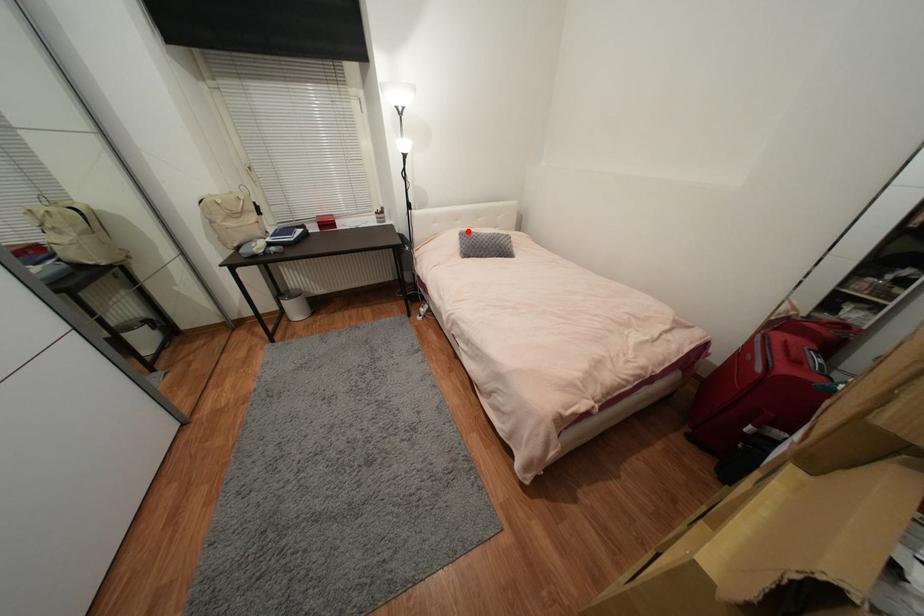
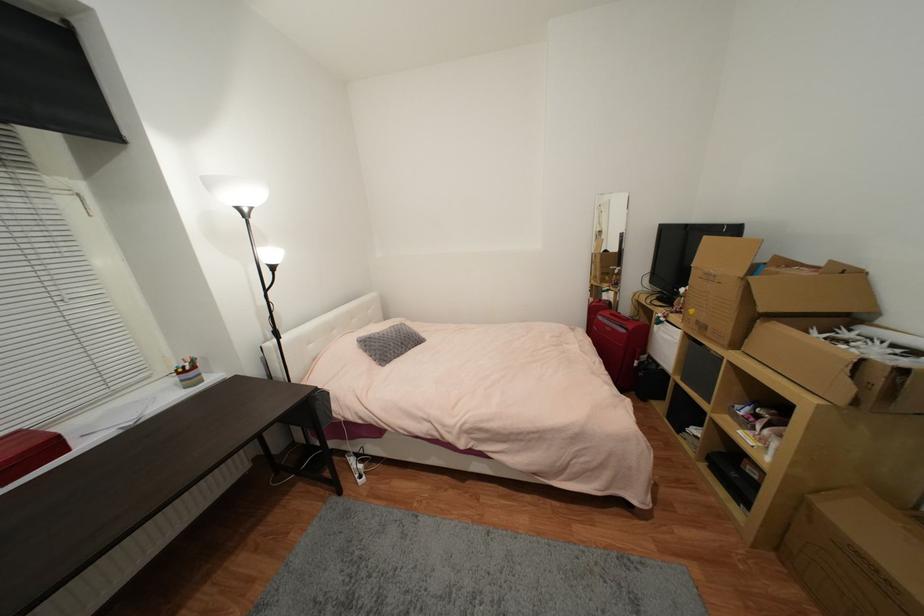
The point at the highlighted location is marked in the first image. Where is the corresponding point in the second image?

(365, 338)